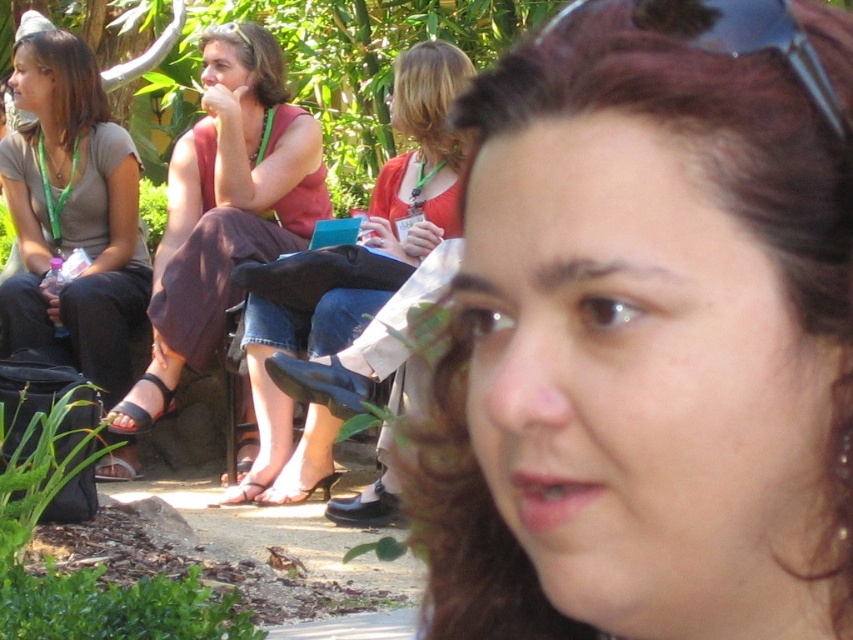
Question: Which of the following is the farthest from the observer?

Choices:
 (A) transparent plastic goggles at upper center
 (B) brown hair at center
 (C) matte pink dress at center
 (D) matte red dress at center

Answer: (C)

Question: Which point appears closest to the camera in this image?

Choices:
 (A) (235, 209)
 (B) (724, 38)
 (C) (401, 157)
 (D) (763, 340)

Answer: (D)

Question: Does matte pink dress at center come in front of matte gray shirt at left?

Choices:
 (A) no
 (B) yes

Answer: (B)

Question: Observing the image, what is the correct spatial positioning of matte gray shirt at left in reference to matte red dress at center?

Choices:
 (A) left
 (B) right

Answer: (A)

Question: Does matte gray shirt at left lie in front of transparent plastic goggles at upper center?

Choices:
 (A) yes
 (B) no

Answer: (B)

Question: Which object is farther from the camera taking this photo?

Choices:
 (A) matte red dress at center
 (B) transparent plastic goggles at upper center
 (C) matte pink dress at center
 (D) matte gray shirt at left

Answer: (D)